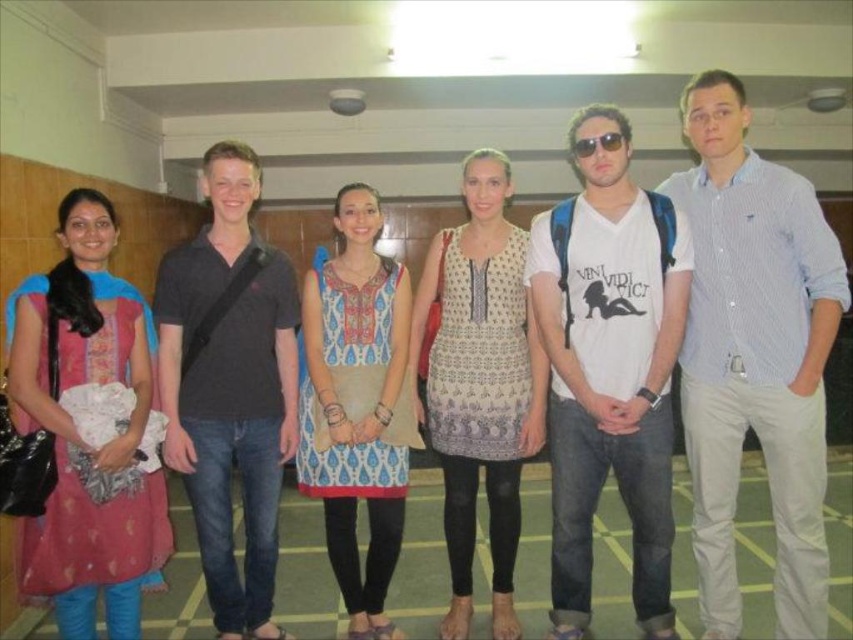
Does point (589, 172) come in front of point (485, 436)?

Yes.

Does white cotton t-shirt at center appear under patterned fabric dress at center?

No.

Who is more distant from viewer, [579,602] or [450,468]?

Positioned behind is point [450,468].

Find the location of a particular element. The width and height of the screenshot is (853, 640). white cotton t-shirt at center is located at coordinates (608, 378).

Looking at this image, is blue striped shirt at center further to the viewer compared to dark gray cotton polo shirt at center?

No, it is not.

What do you see at coordinates (753, 355) in the screenshot? Image resolution: width=853 pixels, height=640 pixels. I see `blue striped shirt at center` at bounding box center [753, 355].

Locate an element on the screen. This screenshot has height=640, width=853. blue striped shirt at center is located at coordinates (753, 355).

Can you confirm if dark gray cotton polo shirt at center is taller than matte pink dress at left?

Indeed, dark gray cotton polo shirt at center has a greater height compared to matte pink dress at left.

Measure the distance between point (223,140) and camera.

10.29 feet

Does point (212, 604) come in front of point (128, 628)?

No, it is not.

Find the location of a particular element. Image resolution: width=853 pixels, height=640 pixels. dark gray cotton polo shirt at center is located at coordinates (230, 390).